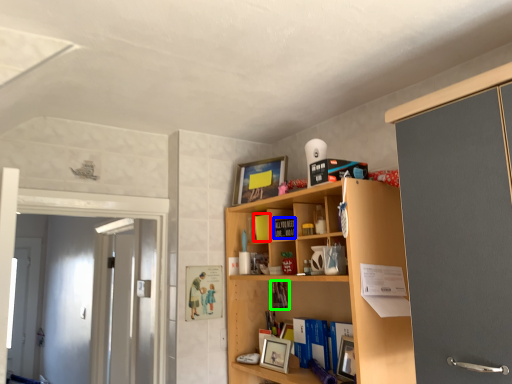
Question: Estimate the real-world distances between objects in this image. Which object is farther from book (highlighted by a red box), book (highlighted by a blue box) or book (highlighted by a green box)?

Choices:
 (A) book
 (B) book

Answer: (B)